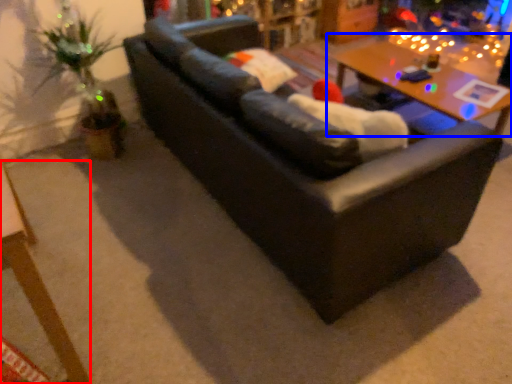
Question: Which object is further to the camera taking this photo, table (highlighted by a red box) or table (highlighted by a blue box)?

Choices:
 (A) table
 (B) table

Answer: (B)